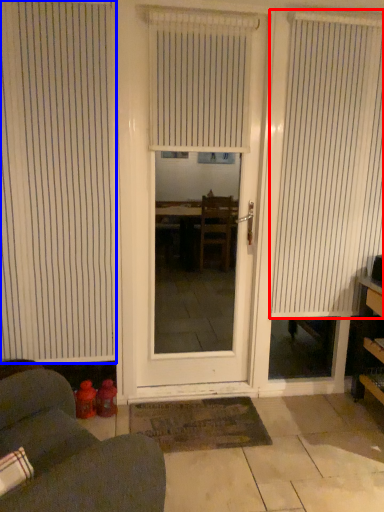
Question: Which point is closer to the camera, window blind (highlighted by a red box) or window blind (highlighted by a blue box)?

Choices:
 (A) window blind
 (B) window blind

Answer: (B)